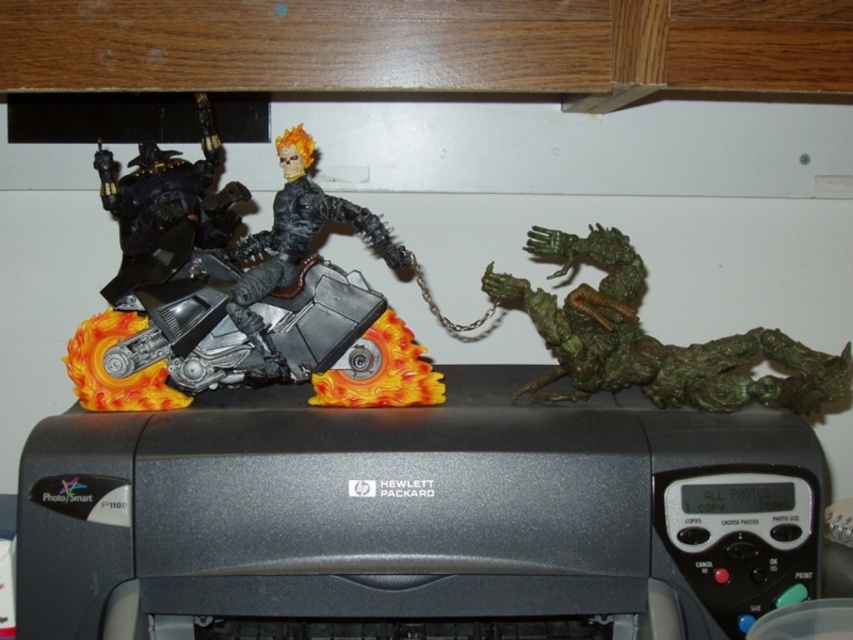
Who is shorter, matte black motorcycle at left or black metallic motorcycle at center?

With less height is matte black motorcycle at left.

Does matte black motorcycle at left have a larger size compared to black metallic motorcycle at center?

Yes, matte black motorcycle at left is bigger than black metallic motorcycle at center.

Does point (151, 269) come behind point (245, 310)?

Yes, it is behind point (245, 310).

What are the coordinates of `matte black motorcycle at left` in the screenshot? It's located at (166, 208).

Describe the element at coordinates (415, 513) in the screenshot. The height and width of the screenshot is (640, 853). I see `black plastic printer at center` at that location.

Is point (233, 611) more distant than point (280, 253)?

No, it is not.

At what (x,y) coordinates should I click in order to perform the action: click on black plastic printer at center. Please return your answer as a coordinate pair (x, y). Image resolution: width=853 pixels, height=640 pixels. Looking at the image, I should click on (415, 513).

Who is shorter, black plastic printer at center or green matte dragon at right?

green matte dragon at right

In the scene shown: Which is more to the left, black plastic printer at center or green matte dragon at right?

→ black plastic printer at center is more to the left.

Identify the location of black plastic printer at center. This screenshot has height=640, width=853. 415,513.